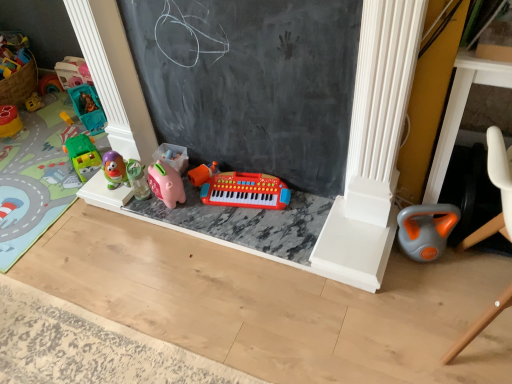
Locate an element on the screen. Image resolution: width=512 pixels, height=384 pixels. free space in front of green plastic car at left, the 5th toy when ordered from right to left is located at coordinates (65, 195).